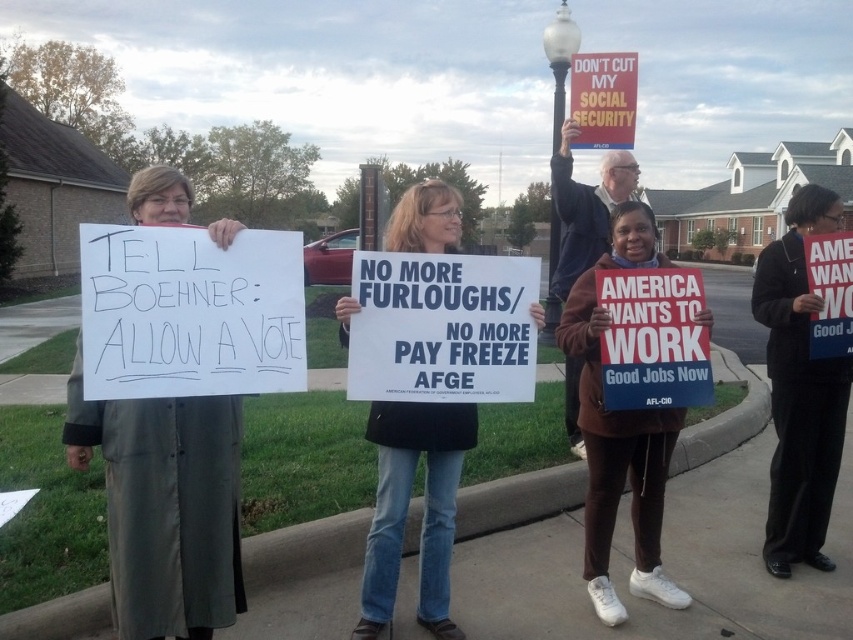
You are a photographer trying to capture a clear shot of the matte red sign at upper center. There is a person wearing a gray fabric coat at left in the way. Based on their heights, can you move the camera down slightly to avoid the person and still see the sign?

The gray fabric coat at left is not as tall as matte red sign at upper center, so lowering the camera might allow the sign to be visible while avoiding the person. However, since the coat is shorter, there might still be parts of the sign visible above the person.

You are a photographer trying to capture a clear photo of the blue jeans at center and the white glass lamp post at upper center. Which object should you focus on first if you want to ensure both are in focus without adjusting your camera settings?

You should focus on the white glass lamp post at upper center first because it is taller than the blue jeans at center, so focusing on the taller object will help ensure both are in focus.